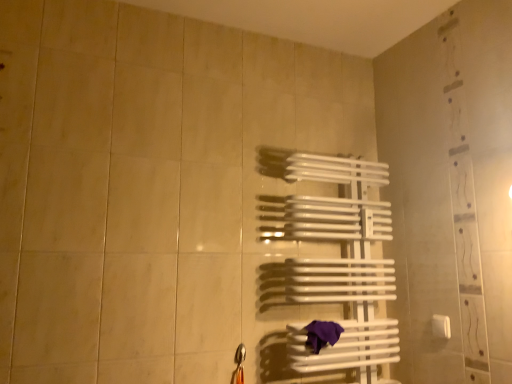
Where is `purple fabric at center`? purple fabric at center is located at coordinates (322, 334).

Image resolution: width=512 pixels, height=384 pixels. Describe the element at coordinates (322, 334) in the screenshot. I see `purple fabric at center` at that location.

Where is `purple fabric at center`? The width and height of the screenshot is (512, 384). purple fabric at center is located at coordinates (322, 334).